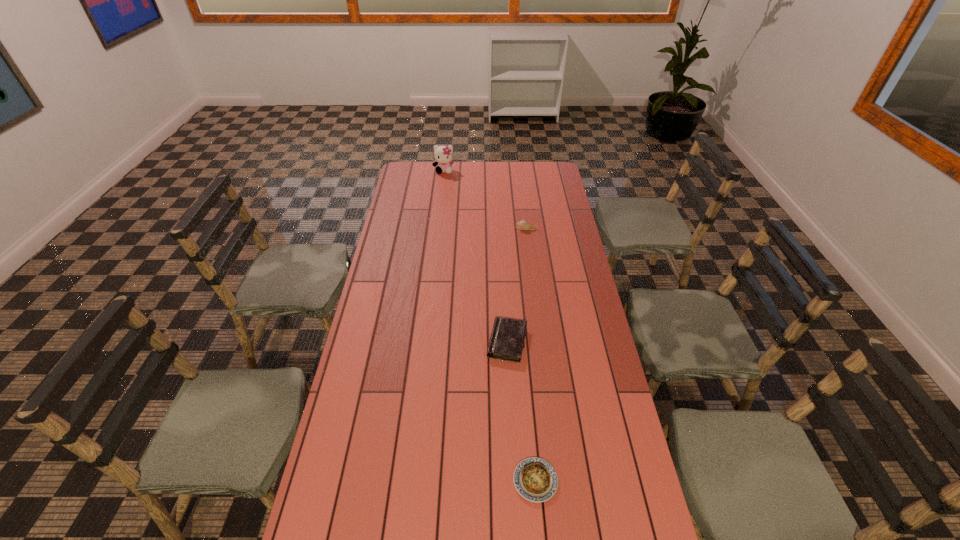
The height and width of the screenshot is (540, 960). Find the location of `the farthest object`. the farthest object is located at coordinates (443, 155).

Identify the location of kitten. (443, 155).

Image resolution: width=960 pixels, height=540 pixels. Identify the location of the third shortest object. (523, 225).

Find the location of a particular element. The image size is (960, 540). escargot is located at coordinates (523, 225).

What are the coordinates of `diary` in the screenshot? It's located at (507, 340).

Locate an element on the screen. The image size is (960, 540). the third farthest object is located at coordinates (507, 340).

Image resolution: width=960 pixels, height=540 pixels. In order to click on the shortest object in this screenshot , I will do `click(535, 479)`.

Find the location of a particular element. quiche is located at coordinates (535, 479).

Find the location of `vacant space situated on the front-facing side of the leftmost object`. vacant space situated on the front-facing side of the leftmost object is located at coordinates (443, 185).

Identify the location of vacant region located on the shell of the third nearest object. The width and height of the screenshot is (960, 540). (481, 229).